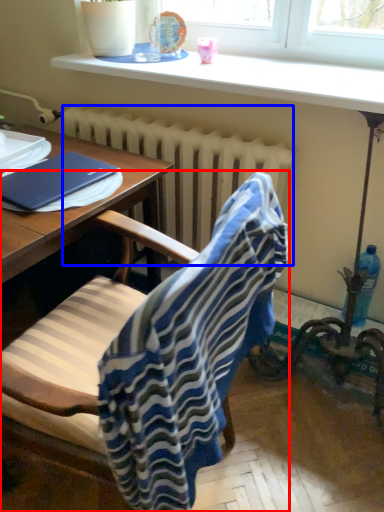
Question: Which object is further to the camera taking this photo, chair (highlighted by a red box) or radiator (highlighted by a blue box)?

Choices:
 (A) chair
 (B) radiator

Answer: (B)